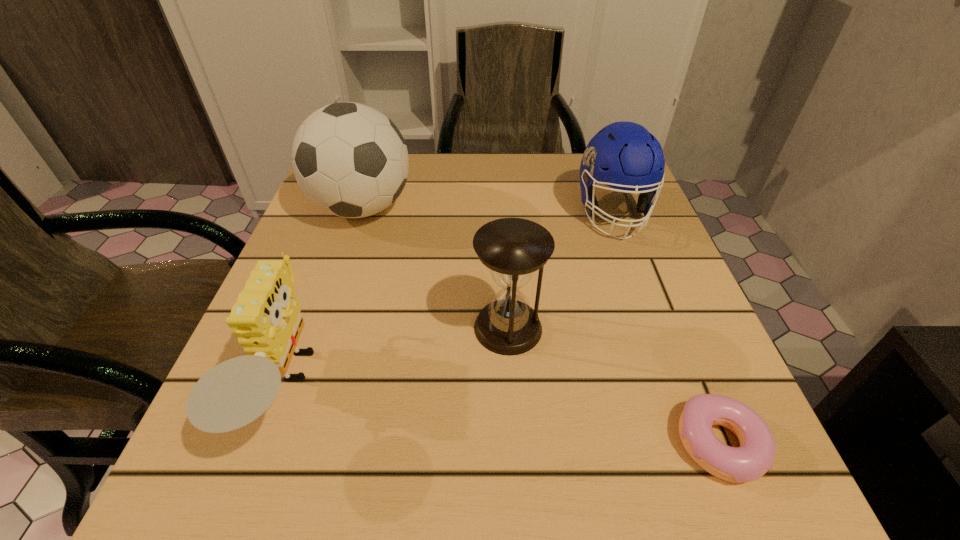
Locate an element on the screen. This screenshot has width=960, height=540. blank region between the sponge and the soccer ball is located at coordinates (324, 298).

Locate an element on the screen. blank region between the hourglass and the football helmet is located at coordinates (561, 271).

I want to click on free point between the hourglass and the football helmet, so click(x=561, y=271).

Locate an element on the screen. vacant area that lies between the football helmet and the doughnut is located at coordinates (666, 329).

Locate an element on the screen. free spot between the sponge and the football helmet is located at coordinates point(449,300).

Image resolution: width=960 pixels, height=540 pixels. What are the coordinates of `the closest object to the tallest object` in the screenshot? It's located at (266, 318).

This screenshot has width=960, height=540. What are the coordinates of `object that is the closest to the soccer ball` in the screenshot? It's located at (266, 318).

I want to click on free spot that satisfies the following two spatial constraints: 1. on the front side of the tallest object; 2. on the front-facing side of the sponge, so click(x=303, y=387).

The height and width of the screenshot is (540, 960). I want to click on vacant area in the image that satisfies the following two spatial constraints: 1. on the front-facing side of the football helmet; 2. on the right side of the shortest object, so click(698, 444).

This screenshot has width=960, height=540. Find the location of `vacant space that satisfies the following two spatial constraints: 1. on the front-facing side of the football helmet; 2. on the right side of the doughnut`. vacant space that satisfies the following two spatial constraints: 1. on the front-facing side of the football helmet; 2. on the right side of the doughnut is located at coordinates (698, 444).